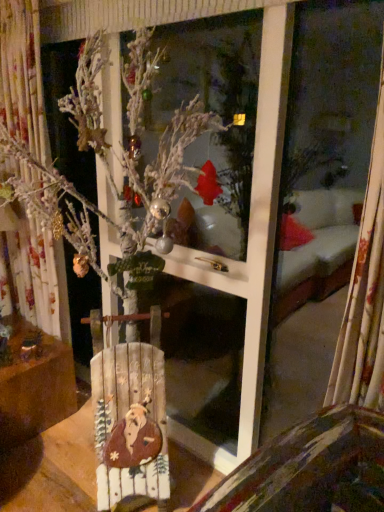
The width and height of the screenshot is (384, 512). What do you see at coordinates (35, 385) in the screenshot? I see `wooden sign at lower left` at bounding box center [35, 385].

Locate an element on the screen. This screenshot has height=512, width=384. wooden sign at lower left is located at coordinates (35, 385).

This screenshot has width=384, height=512. I want to click on wooden sign at center, so click(x=129, y=415).

This screenshot has height=512, width=384. What do you see at coordinates (129, 415) in the screenshot?
I see `wooden sign at center` at bounding box center [129, 415].

Find the location of a particular element. wooden sign at lower left is located at coordinates (35, 385).

Does wooden sign at center appear on the right side of wooden sign at lower left?

Correct, you'll find wooden sign at center to the right of wooden sign at lower left.

Between wooden sign at center and wooden sign at lower left, which one is positioned behind?

wooden sign at lower left is more distant.

Which is farther from the camera, [114,361] or [10,426]?

Positioned behind is point [10,426].

From the image's perspective, which one is positioned higher, wooden sign at center or wooden sign at lower left?

wooden sign at center appears higher in the image.

From a real-world perspective, which is physically above, wooden sign at center or wooden sign at lower left?

wooden sign at center, from a real-world perspective.

Between wooden sign at center and wooden sign at lower left, which one has larger width?

wooden sign at lower left is wider.

Can you confirm if wooden sign at center is taller than wooden sign at lower left?

Indeed, wooden sign at center has a greater height compared to wooden sign at lower left.

Does wooden sign at center have a larger size compared to wooden sign at lower left?

No, wooden sign at center is not bigger than wooden sign at lower left.

Is wooden sign at center positioned beyond the bounds of wooden sign at lower left?

Yes, wooden sign at center is located beyond the bounds of wooden sign at lower left.

Is wooden sign at center with wooden sign at lower left?

wooden sign at center and wooden sign at lower left are not in contact.

Is wooden sign at center oriented towards wooden sign at lower left?

No, wooden sign at center is not aimed at wooden sign at lower left.

Find the location of a particular element. The height and width of the screenshot is (512, 384). furniture lying below the wooden sign at center (from the image's perspective) is located at coordinates (35, 385).

Is wooden sign at lower left to the right of wooden sign at center from the viewer's perspective?

Incorrect, wooden sign at lower left is not on the right side of wooden sign at center.

Is the position of wooden sign at lower left less distant than that of wooden sign at center?

No, it is not.

Considering the points (20, 329) and (144, 429), which point is in front, point (20, 329) or point (144, 429)?

Point (144, 429)

From the image's perspective, which is above, wooden sign at lower left or wooden sign at center?

wooden sign at center, from the image's perspective.

From a real-world perspective, is wooden sign at lower left beneath wooden sign at center?

Correct, in the physical world, wooden sign at lower left is lower than wooden sign at center.

Between wooden sign at lower left and wooden sign at center, which one has smaller width?

With smaller width is wooden sign at center.

Considering the sizes of objects wooden sign at lower left and wooden sign at center in the image provided, who is taller, wooden sign at lower left or wooden sign at center?

With more height is wooden sign at center.

Can you confirm if wooden sign at lower left is smaller than wooden sign at center?

Actually, wooden sign at lower left might be larger than wooden sign at center.

Is wooden sign at center surrounded by wooden sign at lower left?

No, wooden sign at center is not a part of wooden sign at lower left.

Is wooden sign at lower left placed right next to wooden sign at center?

wooden sign at lower left is not next to wooden sign at center, and they're not touching.

Could you tell me if wooden sign at lower left is facing wooden sign at center?

Yes, wooden sign at lower left faces towards wooden sign at center.

Where is `armchair that appears on the right of wooden sign at lower left`? The image size is (384, 512). armchair that appears on the right of wooden sign at lower left is located at coordinates (129, 415).

In the image, there is a wooden sign at center. Where is `furniture below it (from a real-world perspective)`? Image resolution: width=384 pixels, height=512 pixels. furniture below it (from a real-world perspective) is located at coordinates (35, 385).

At what (x,y) coordinates should I click in order to perform the action: click on furniture that is behind the wooden sign at center. Please return your answer as a coordinate pair (x, y). This screenshot has height=512, width=384. Looking at the image, I should click on (35, 385).